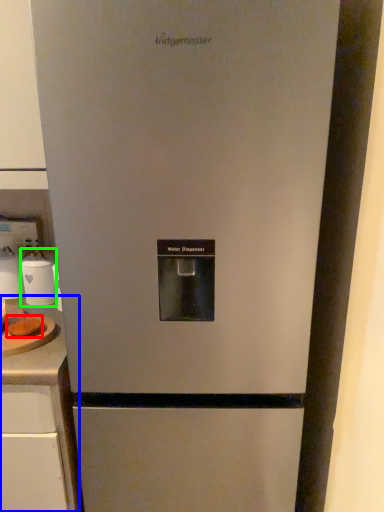
Question: Which object is the farthest from food (highlighted by a red box)? Choose among these: counter top (highlighted by a blue box) or appliance (highlighted by a green box).

Choices:
 (A) counter top
 (B) appliance

Answer: (A)